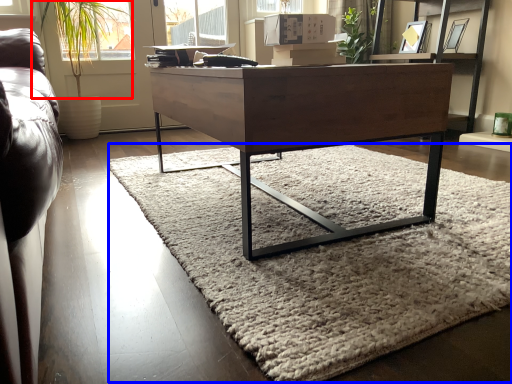
Question: Which point is closer to the camera, plant (highlighted by a red box) or mat (highlighted by a blue box)?

Choices:
 (A) plant
 (B) mat

Answer: (B)